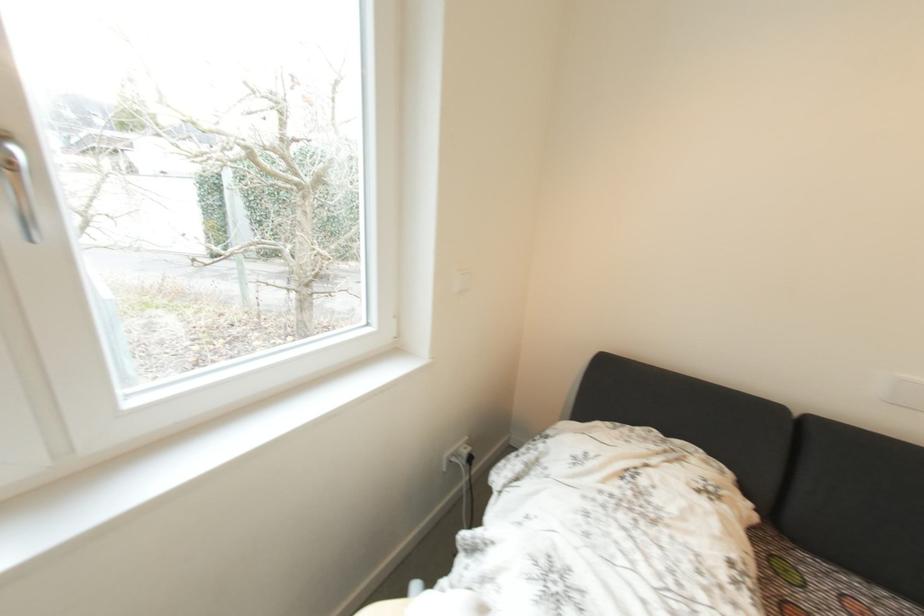
Describe the element at coordinates (460, 281) in the screenshot. I see `the white light switch` at that location.